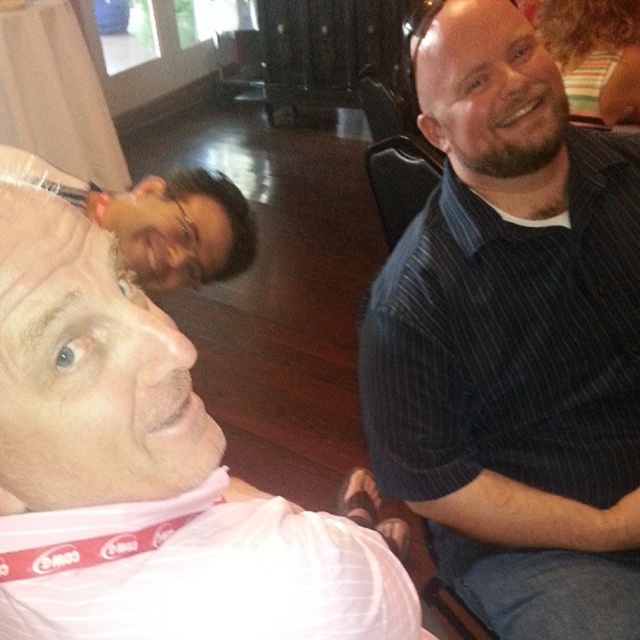
You are standing in the room where the three people are seated. You see a point at coordinates (x=513, y=339). What object is located at that point?

The dark blue striped shirt at right is located at point (x=513, y=339).

You are a photographer trying to capture a group photo of the dark blue striped shirt at right and the dark brown hair at upper left. If you want to ensure both are fully visible in the frame, which object should you position closer to the camera?

The dark blue striped shirt at right might be wider than dark brown hair at upper left, so you should position the dark blue striped shirt at right closer to the camera to ensure both fit in the frame.